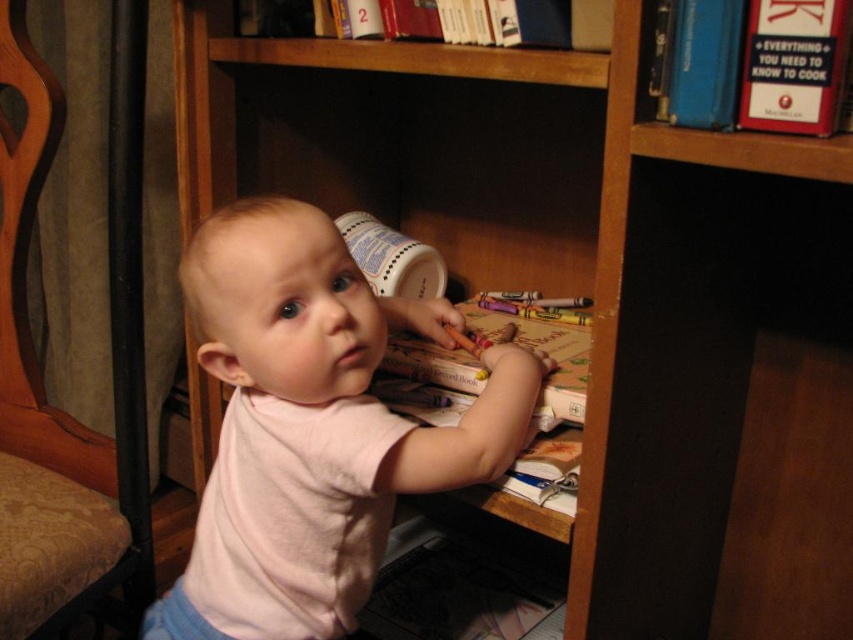
Question: Which point is closer to the camera?

Choices:
 (A) hardcover book at upper right
 (B) wooden armchair at left

Answer: (A)

Question: Based on their relative distances, which object is nearer to the wooden armchair at left?

Choices:
 (A) hardcover book at upper right
 (B) hardcover book at center
 (C) pink cotton baby at center

Answer: (C)

Question: Can you confirm if pink cotton baby at center is bigger than wooden armchair at left?

Choices:
 (A) no
 (B) yes

Answer: (B)

Question: Is hardcover book at upper right below hardcover book at center?

Choices:
 (A) no
 (B) yes

Answer: (A)

Question: Which of the following is the farthest from the observer?

Choices:
 (A) hardcover book at upper right
 (B) wooden armchair at left
 (C) hardcover book at upper center

Answer: (B)

Question: Is hardcover book at upper right below hardcover book at upper center?

Choices:
 (A) no
 (B) yes

Answer: (B)